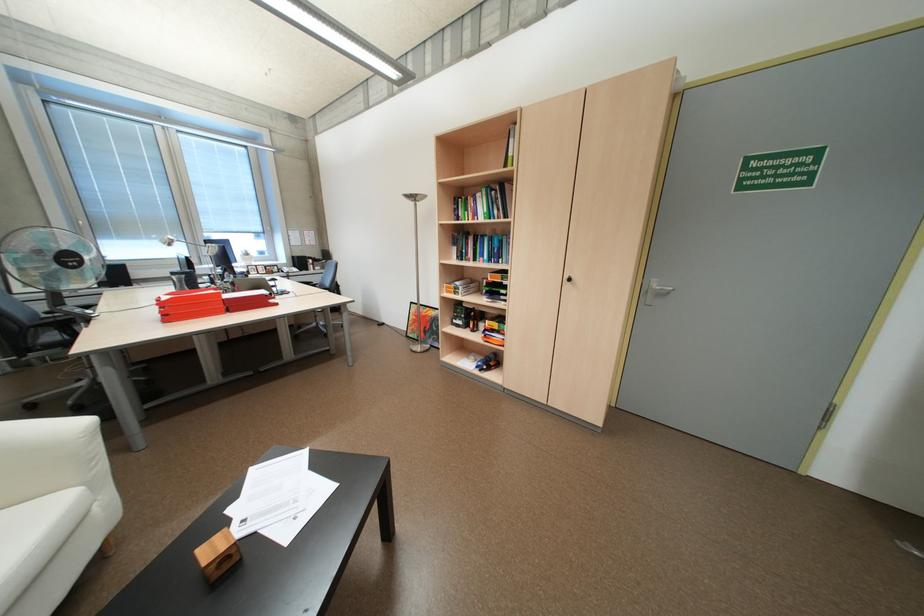
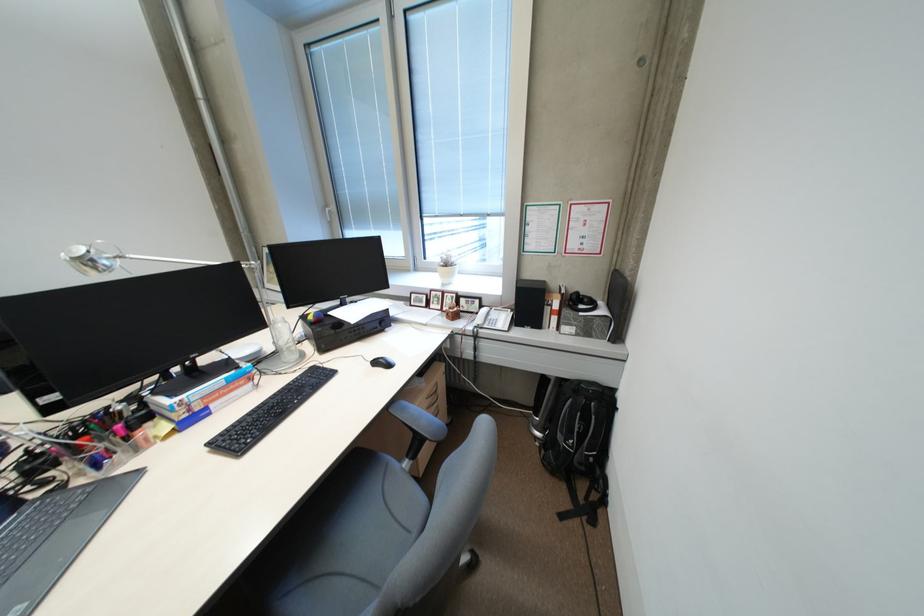
Question: I am providing you with two images of the same scene from different viewpoints. Which of the following objects are not visible in image2?

Choices:
 (A) black receiver dial
 (B) small potted plant
 (C) small colorful ball
 (D) none of these

Answer: (D)